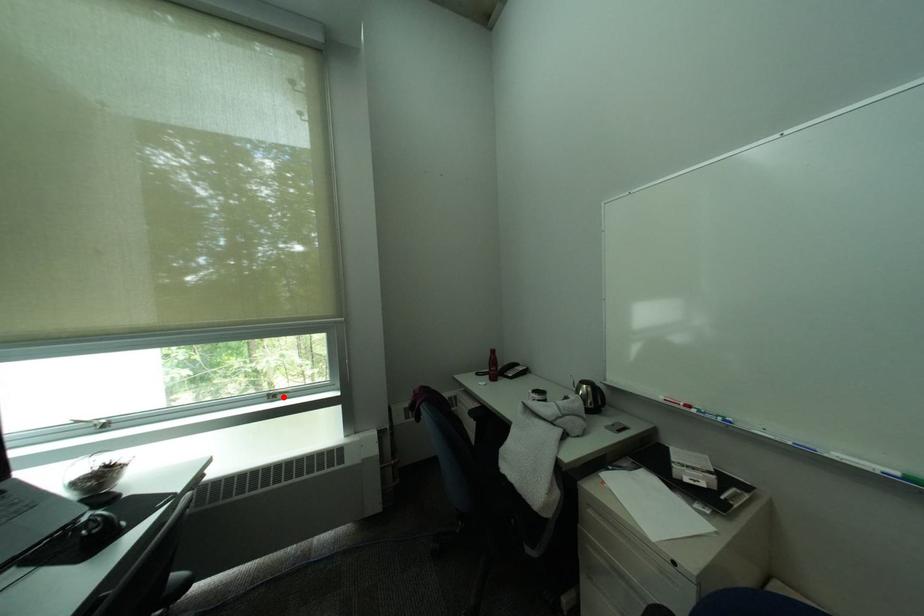
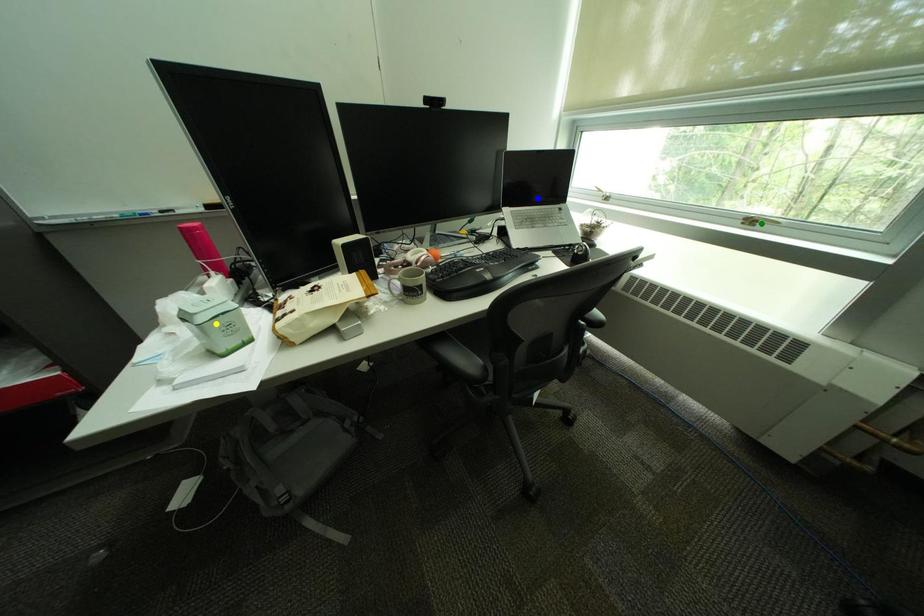
Question: I am providing you with two images of the same scene from different viewpoints. A red point is marked on the first image. You are given multiple points on the second image. Which mark in image 2 goes with the point in image 1?

Choices:
 (A) green point
 (B) yellow point
 (C) blue point

Answer: (A)